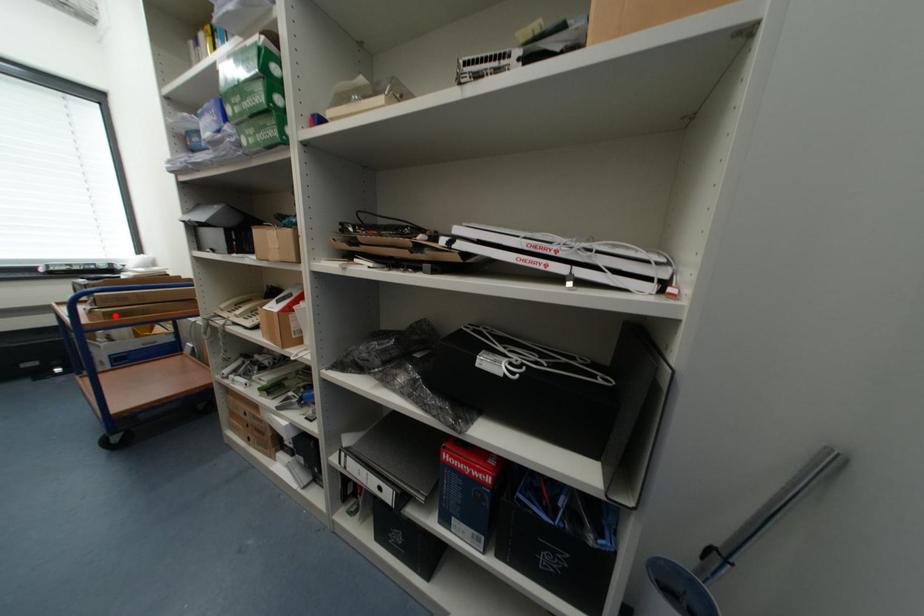
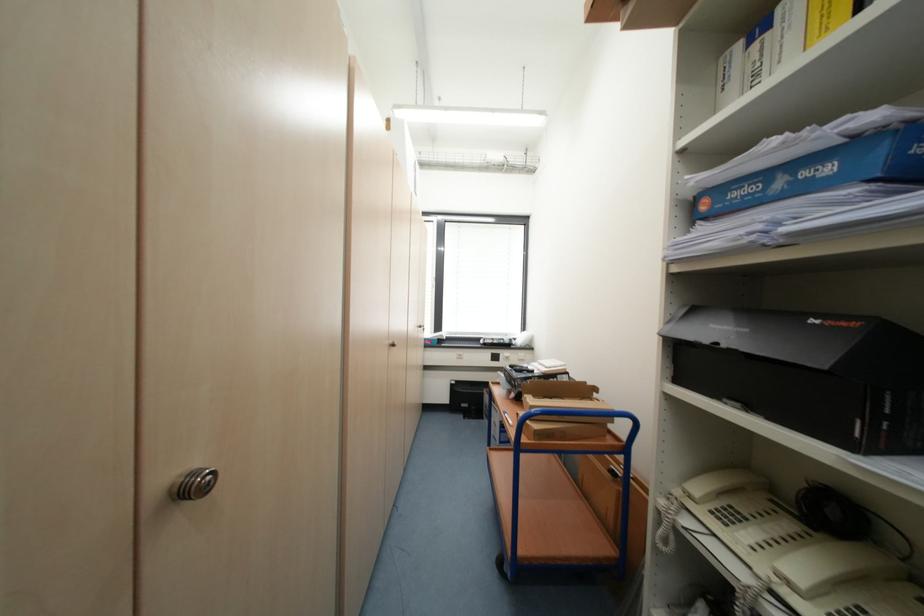
The point at the highlighted location is marked in the first image. Where is the corresponding point in the second image?

(544, 436)